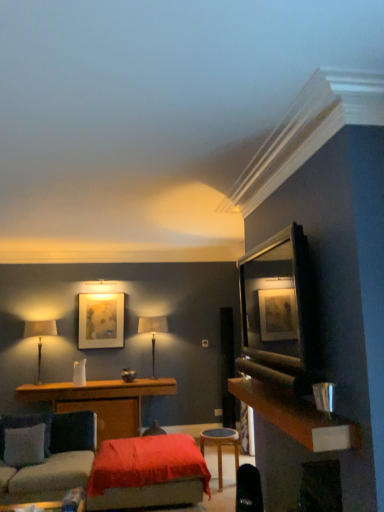
Question: Does wooden stool at center, marked as the second table in a left-to-right arrangement, come in front of wooden dresser at right?

Choices:
 (A) yes
 (B) no

Answer: (B)

Question: Considering the relative sizes of wooden stool at center, the 1th table viewed from the front, and wooden dresser at right in the image provided, is wooden stool at center, the 1th table viewed from the front, smaller than wooden dresser at right?

Choices:
 (A) yes
 (B) no

Answer: (B)

Question: Considering the relative sizes of wooden stool at center, the second table when ordered from back to front, and wooden dresser at right in the image provided, is wooden stool at center, the second table when ordered from back to front, taller than wooden dresser at right?

Choices:
 (A) yes
 (B) no

Answer: (A)

Question: Is wooden stool at center, marked as the second table in a left-to-right arrangement, positioned beyond the bounds of wooden dresser at right?

Choices:
 (A) yes
 (B) no

Answer: (A)

Question: Can you see wooden stool at center, the 1th table viewed from the front, touching wooden dresser at right?

Choices:
 (A) no
 (B) yes

Answer: (A)

Question: Considering the relative sizes of wooden stool at center, the 1th table from the right, and wooden dresser at right in the image provided, is wooden stool at center, the 1th table from the right, thinner than wooden dresser at right?

Choices:
 (A) no
 (B) yes

Answer: (A)

Question: Does wooden dresser at right lie behind matte gold picture frame at upper center?

Choices:
 (A) yes
 (B) no

Answer: (B)

Question: Could you tell me if wooden dresser at right is facing matte gold picture frame at upper center?

Choices:
 (A) yes
 (B) no

Answer: (B)

Question: Considering the relative positions of wooden dresser at right and matte gold picture frame at upper center in the image provided, is wooden dresser at right to the left of matte gold picture frame at upper center from the viewer's perspective?

Choices:
 (A) yes
 (B) no

Answer: (B)

Question: Can you confirm if wooden dresser at right is smaller than matte gold picture frame at upper center?

Choices:
 (A) no
 (B) yes

Answer: (A)

Question: Considering the relative sizes of wooden dresser at right and matte gold picture frame at upper center in the image provided, is wooden dresser at right wider than matte gold picture frame at upper center?

Choices:
 (A) no
 (B) yes

Answer: (B)

Question: From a real-world perspective, is wooden dresser at right positioned under matte gold picture frame at upper center based on gravity?

Choices:
 (A) yes
 (B) no

Answer: (A)

Question: Would you say matte beige table lamp at left, which is counted as the second table lamp, starting from the right, is outside velvet red ottoman at center?

Choices:
 (A) yes
 (B) no

Answer: (A)